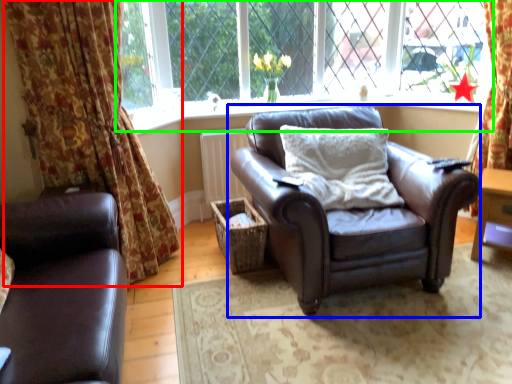
Question: Which object is the farthest from curtain (highlighted by a red box)? Choose among these: chair (highlighted by a blue box) or window (highlighted by a green box).

Choices:
 (A) chair
 (B) window

Answer: (B)